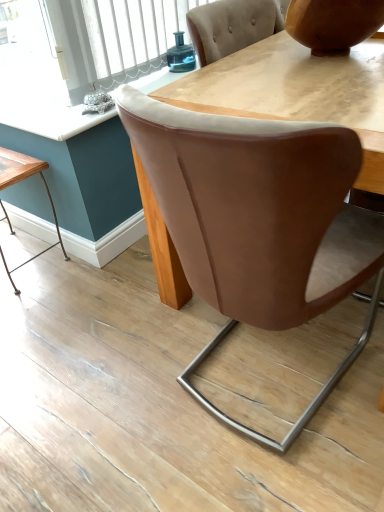
Question: Is wooden table at lower left facing away from matte brown vase at upper right?

Choices:
 (A) yes
 (B) no

Answer: (B)

Question: Is matte brown vase at upper right inside wooden table at lower left?

Choices:
 (A) no
 (B) yes

Answer: (A)

Question: Considering the relative sizes of wooden table at lower left and matte brown vase at upper right in the image provided, is wooden table at lower left bigger than matte brown vase at upper right?

Choices:
 (A) yes
 (B) no

Answer: (A)

Question: From a real-world perspective, is wooden table at lower left positioned over matte brown vase at upper right based on gravity?

Choices:
 (A) no
 (B) yes

Answer: (A)

Question: Considering the relative sizes of wooden table at lower left and matte brown vase at upper right in the image provided, is wooden table at lower left wider than matte brown vase at upper right?

Choices:
 (A) yes
 (B) no

Answer: (B)

Question: Which is correct: brown leather chair at center is inside matte brown vase at upper right, or outside of it?

Choices:
 (A) outside
 (B) inside

Answer: (A)

Question: From the image's perspective, is brown leather chair at center positioned above or below matte brown vase at upper right?

Choices:
 (A) above
 (B) below

Answer: (B)

Question: Considering the positions of brown leather chair at center and matte brown vase at upper right in the image, is brown leather chair at center wider or thinner than matte brown vase at upper right?

Choices:
 (A) wide
 (B) thin

Answer: (A)

Question: Considering their positions, is brown leather chair at center located in front of or behind matte brown vase at upper right?

Choices:
 (A) behind
 (B) front

Answer: (B)

Question: Based on their positions, is wooden table at lower left located to the left or right of matte wooden table at center?

Choices:
 (A) right
 (B) left

Answer: (B)

Question: From a real-world perspective, relative to matte wooden table at center, is wooden table at lower left vertically above or below?

Choices:
 (A) above
 (B) below

Answer: (B)

Question: Would you say wooden table at lower left is inside or outside matte wooden table at center?

Choices:
 (A) outside
 (B) inside

Answer: (A)

Question: In terms of height, does wooden table at lower left look taller or shorter compared to matte wooden table at center?

Choices:
 (A) short
 (B) tall

Answer: (B)

Question: From a real-world perspective, is teal glass jar at upper center physically located above or below matte wooden table at center?

Choices:
 (A) below
 (B) above

Answer: (A)

Question: From the image's perspective, is teal glass jar at upper center positioned above or below matte wooden table at center?

Choices:
 (A) below
 (B) above

Answer: (B)